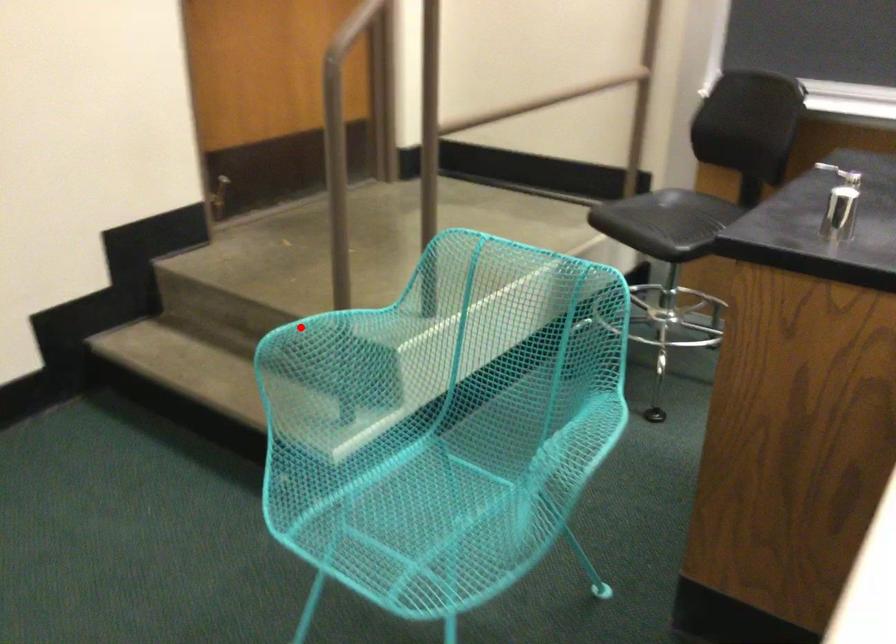
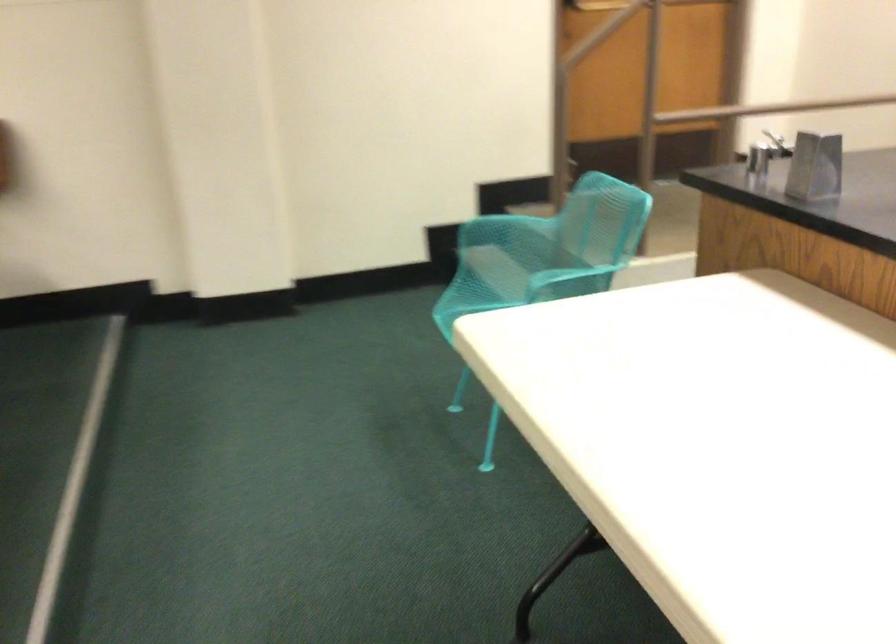
Question: I am providing you with two images of the same scene from different viewpoints. In image1, a red point is highlighted. Considering the same 3D point in image2, which of the following is correct?

Choices:
 (A) It is closer
 (B) It is farther

Answer: (B)